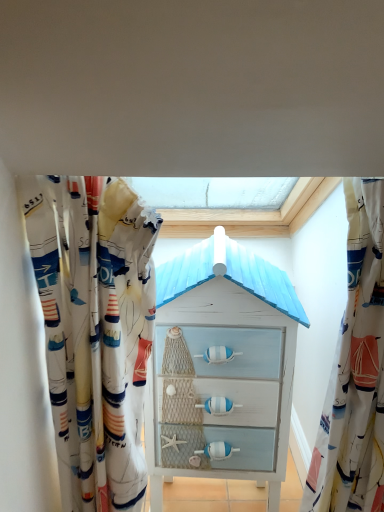
Question: In terms of height, does white fabric curtain at right, arranged as the 1th curtain when viewed from the right, look taller or shorter compared to white fabric curtain at left, the first curtain from the left?

Choices:
 (A) tall
 (B) short

Answer: (B)

Question: Looking at their shapes, would you say white fabric curtain at right, arranged as the 1th curtain when viewed from the right, is wider or thinner than white fabric curtain at left, the 2th curtain from the right?

Choices:
 (A) thin
 (B) wide

Answer: (A)

Question: Based on their relative distances, which object is nearer to the white painted wood chest of drawers at center?

Choices:
 (A) white fabric curtain at right, the 2th curtain from the left
 (B) white fabric curtain at left, the 2th curtain from the right

Answer: (B)

Question: Estimate the real-world distances between objects in this image. Which object is farther from the white fabric curtain at left, the first curtain from the left?

Choices:
 (A) white fabric curtain at right, the 2th curtain from the left
 (B) white painted wood chest of drawers at center

Answer: (A)